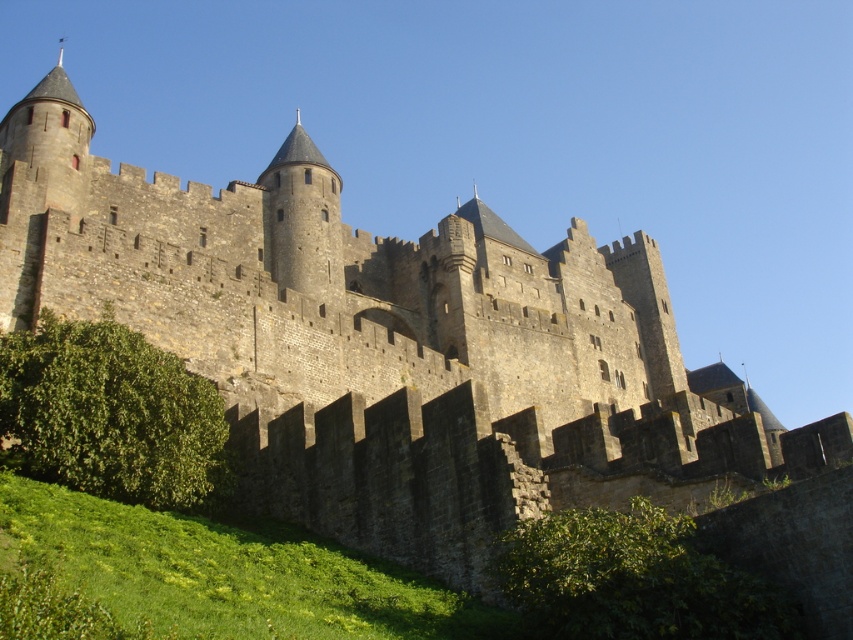
Looking at this image, which is below, green leafy hedge at lower left or green leafy hedge at lower center?

green leafy hedge at lower center is below.

Who is taller, green leafy hedge at lower left or green leafy hedge at lower center?

green leafy hedge at lower left is taller.

Is point (93, 449) in front of point (682, 541)?

No, it is behind (682, 541).

Find the location of a particular element. The height and width of the screenshot is (640, 853). green leafy hedge at lower left is located at coordinates tap(111, 413).